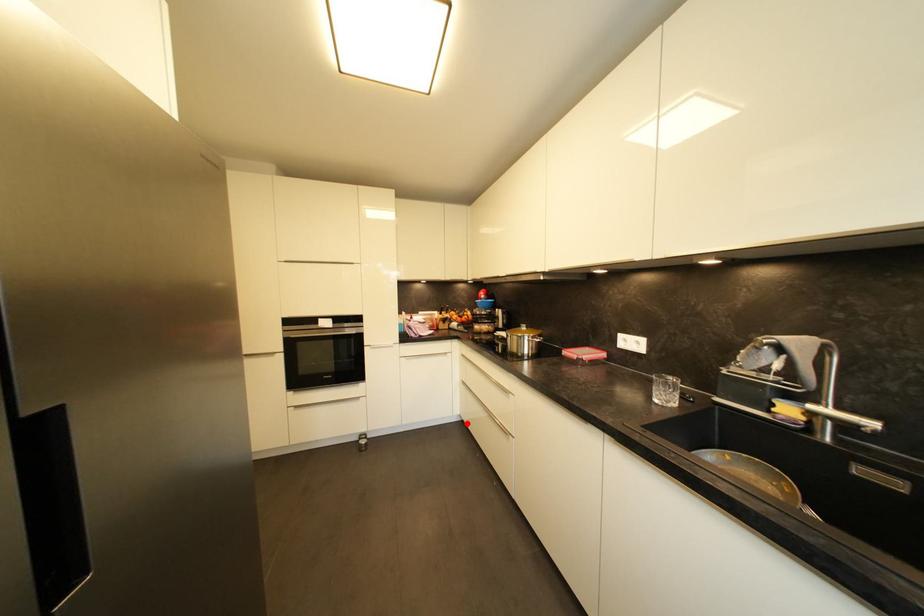
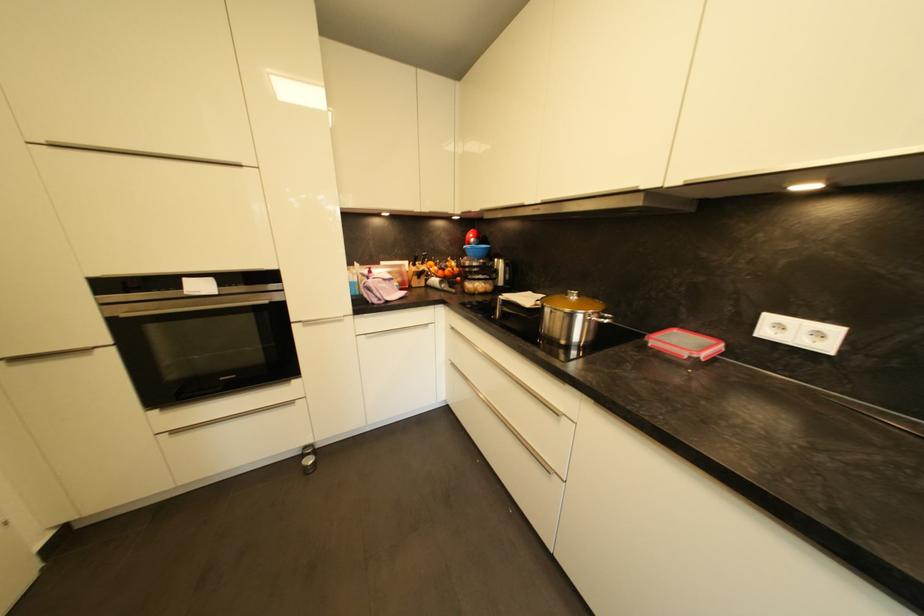
Find the pixel in the second image that matches the highlighted location in the first image.

(453, 408)